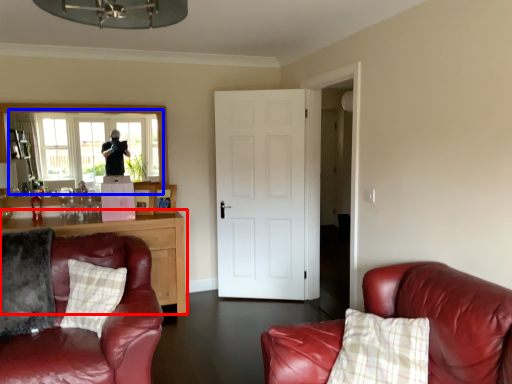
Question: Which of the following is the closest to the observer, cabinetry (highlighted by a red box) or window (highlighted by a blue box)?

Choices:
 (A) cabinetry
 (B) window

Answer: (A)